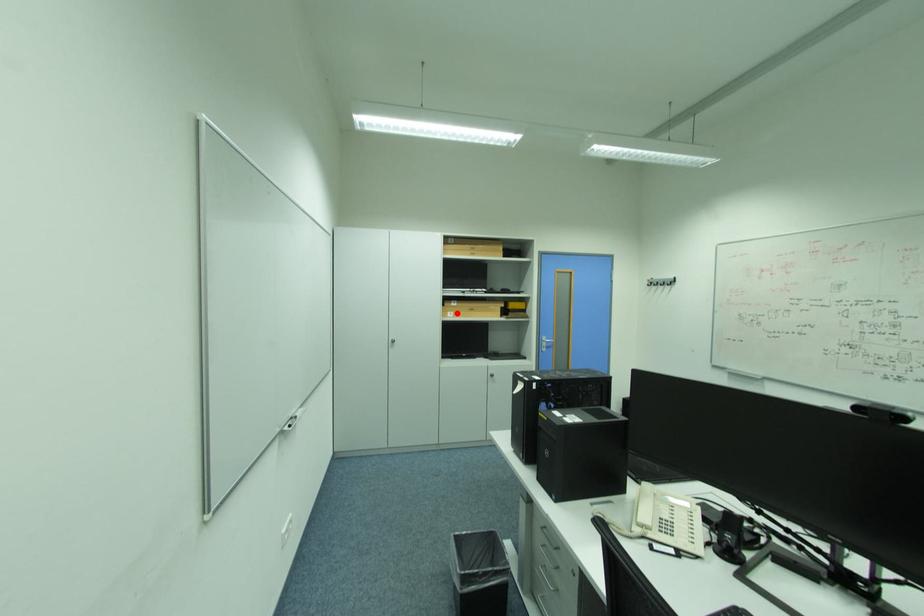
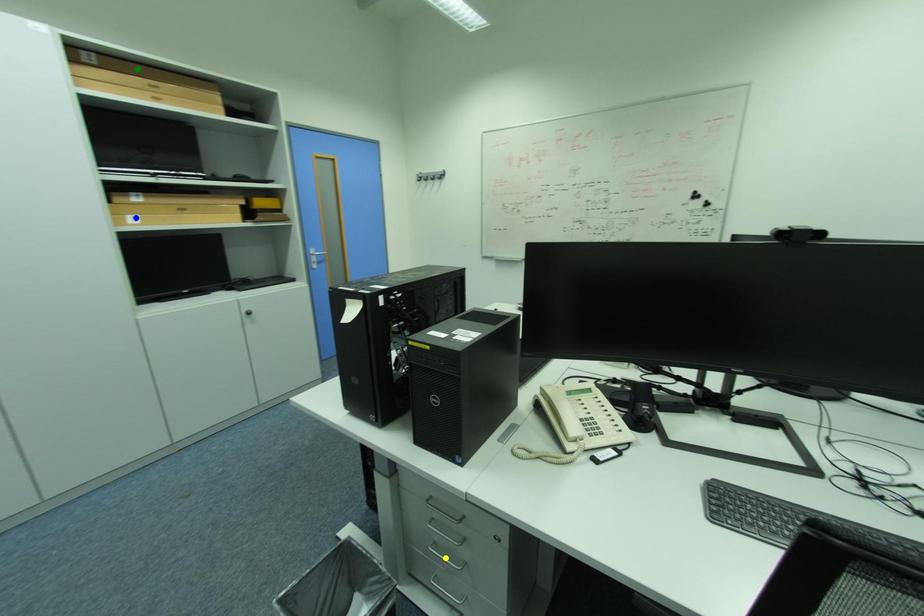
Question: I am providing you with two images of the same scene from different viewpoints. A red point is marked on the first image. You are given multiple points on the second image. Which point in image 2 represents the same 3d spot as the red point in image 1?

Choices:
 (A) blue point
 (B) yellow point
 (C) green point

Answer: (A)